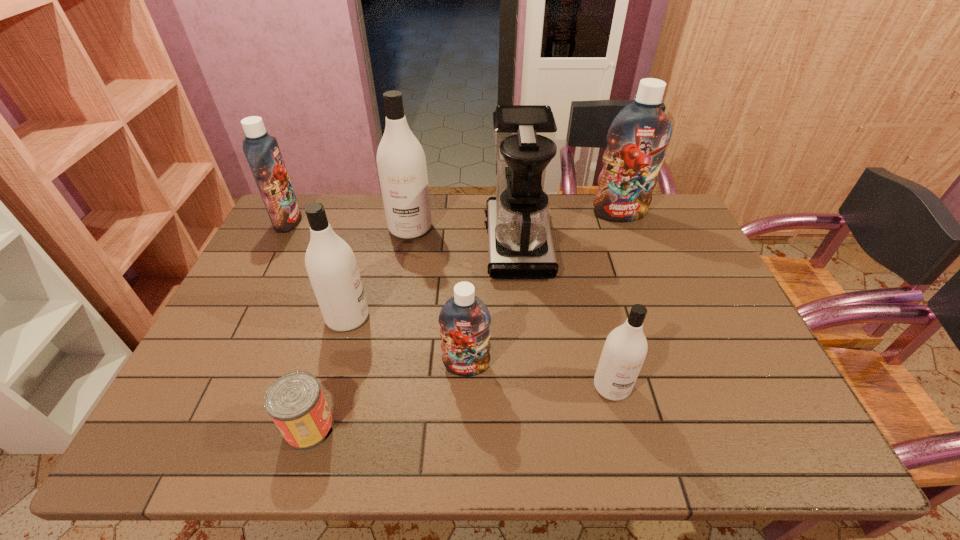
Locate an element on the screen. the biggest white shampoo is located at coordinates (401, 163).

The width and height of the screenshot is (960, 540). What are the coordinates of `the rightmost blue shampoo` in the screenshot? It's located at (638, 136).

Where is `the rightmost object`? the rightmost object is located at coordinates (638, 136).

At what (x,y) coordinates should I click in order to perform the action: click on coffee maker. Please return your answer as a coordinate pair (x, y). This screenshot has width=960, height=540. Looking at the image, I should click on (520, 246).

Image resolution: width=960 pixels, height=540 pixels. Identify the location of the leftmost blue shampoo. (262, 152).

Locate an element on the screen. The image size is (960, 540). the leftmost shampoo is located at coordinates [x=262, y=152].

Locate an element on the screen. the fourth nearest object is located at coordinates (330, 262).

Locate an element on the screen. This screenshot has height=540, width=960. the third nearest shampoo is located at coordinates pos(330,262).

Where is `the smallest blue shampoo`? the smallest blue shampoo is located at coordinates (464, 319).

The height and width of the screenshot is (540, 960). I want to click on the second blue shampoo from left to right, so coord(464,319).